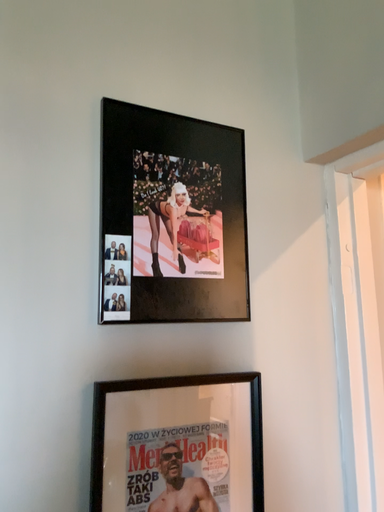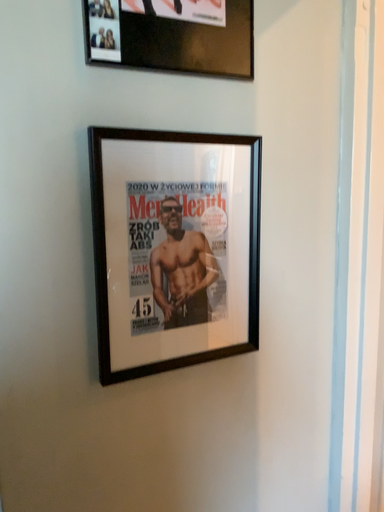
Question: Which way did the camera rotate in the video?

Choices:
 (A) rotated upward
 (B) rotated downward

Answer: (B)